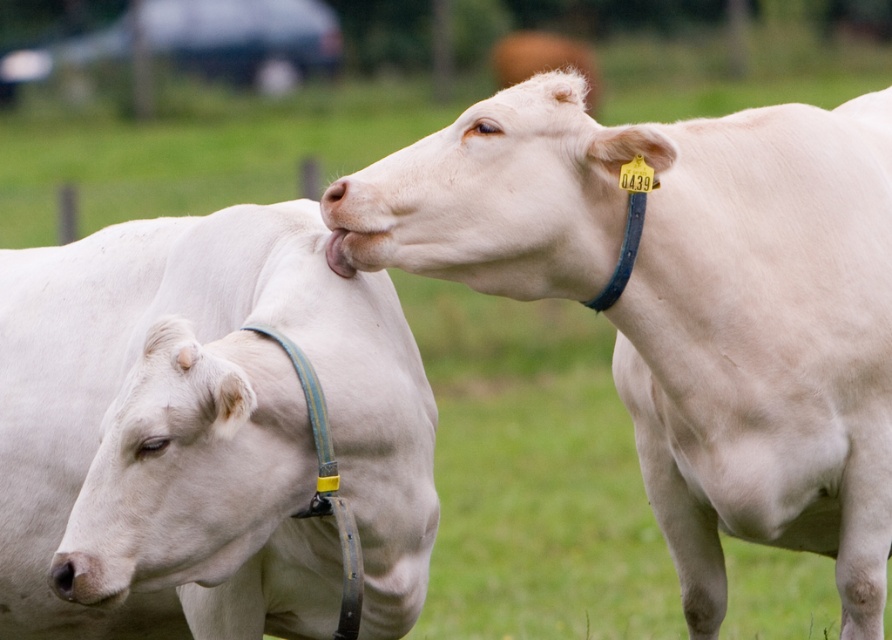
Question: Among these points, which one is nearest to the camera?

Choices:
 (A) (683, 356)
 (B) (176, 512)

Answer: (B)

Question: Is white smooth cow at upper right bigger than white leather collar at left?

Choices:
 (A) yes
 (B) no

Answer: (A)

Question: Which object appears farthest from the camera in this image?

Choices:
 (A) white leather collar at left
 (B) white smooth cow at upper right

Answer: (B)

Question: Is white smooth cow at upper right to the left of white leather collar at left from the viewer's perspective?

Choices:
 (A) yes
 (B) no

Answer: (B)

Question: Which point is farther to the camera?

Choices:
 (A) (585, 164)
 (B) (295, 253)

Answer: (B)

Question: Does white smooth cow at upper right appear over white leather collar at left?

Choices:
 (A) yes
 (B) no

Answer: (A)